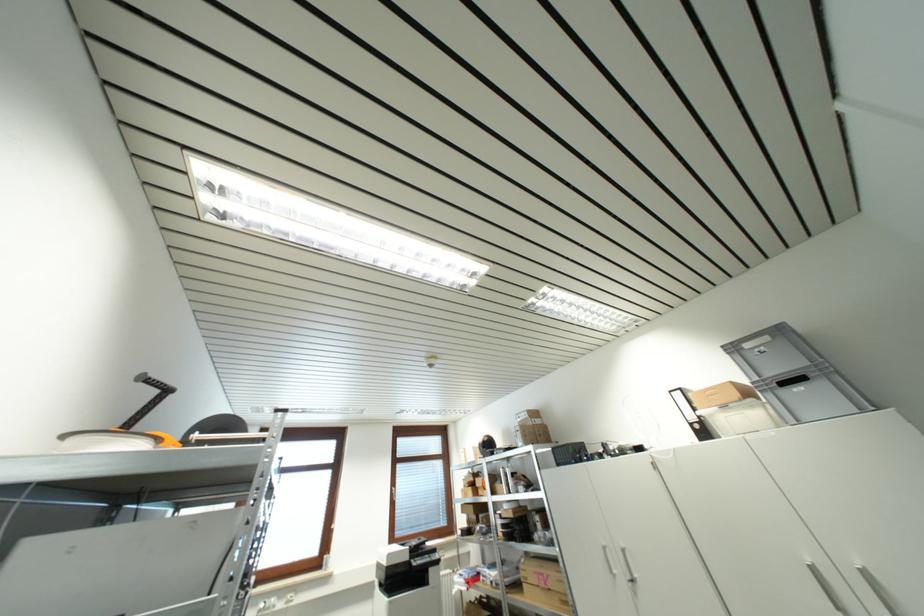
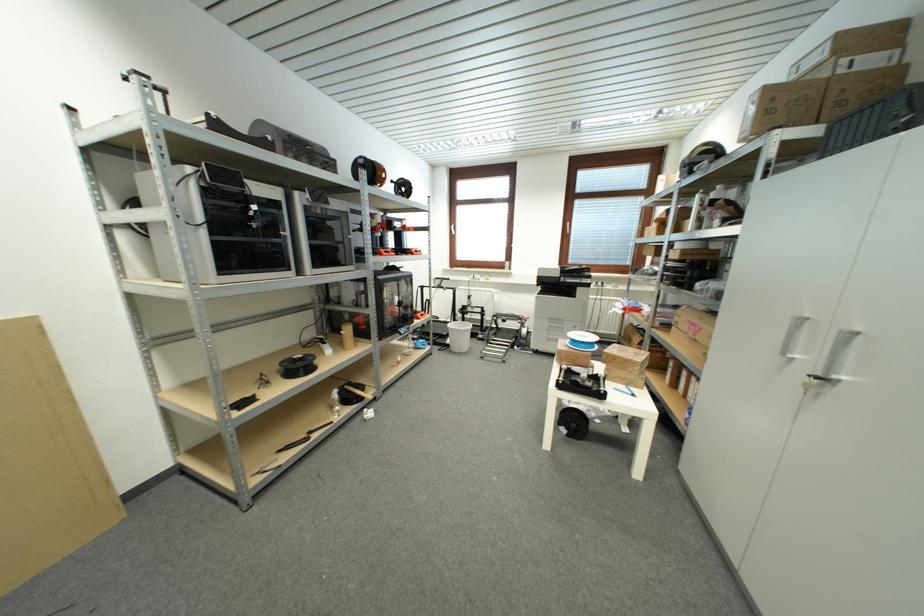
The point at [523,431] is marked in the first image. Where is the corresponding point in the second image?

(761, 99)